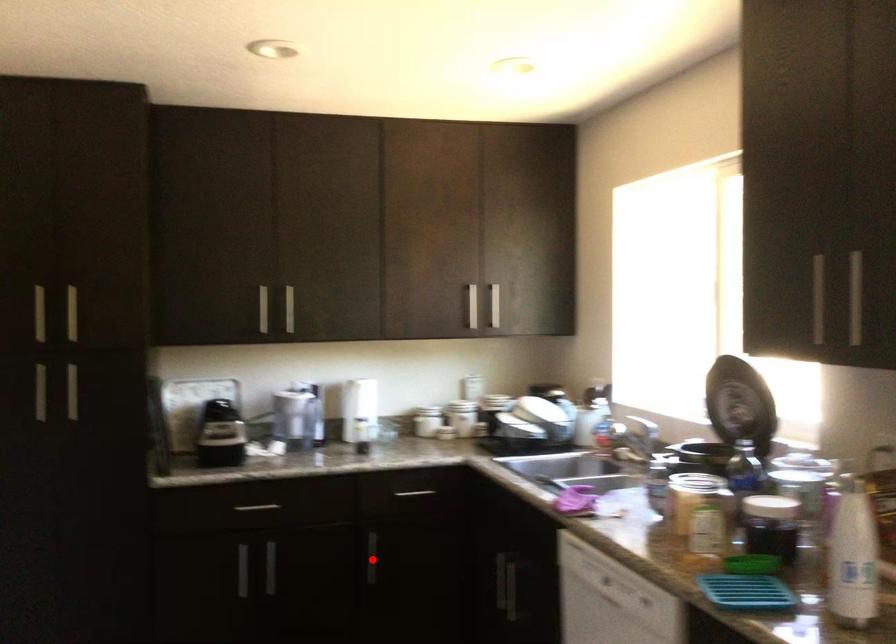
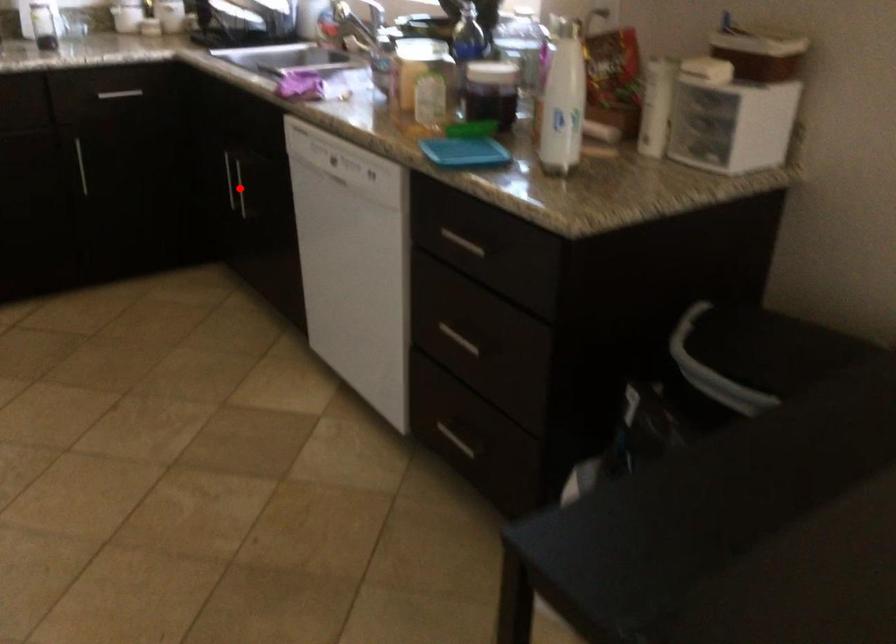
I am providing you with two images of the same scene from different viewpoints. A red point is marked on the first image and another point is marked on the second image. Is the marked point in image1 the same physical position as the marked point in image2?

No